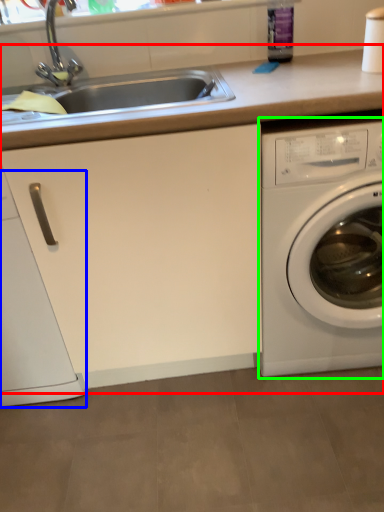
Question: Which object is the closest to the counter top (highlighted by a red box)? Choose among these: dish washer (highlighted by a blue box) or washing machine (highlighted by a green box).

Choices:
 (A) dish washer
 (B) washing machine

Answer: (B)